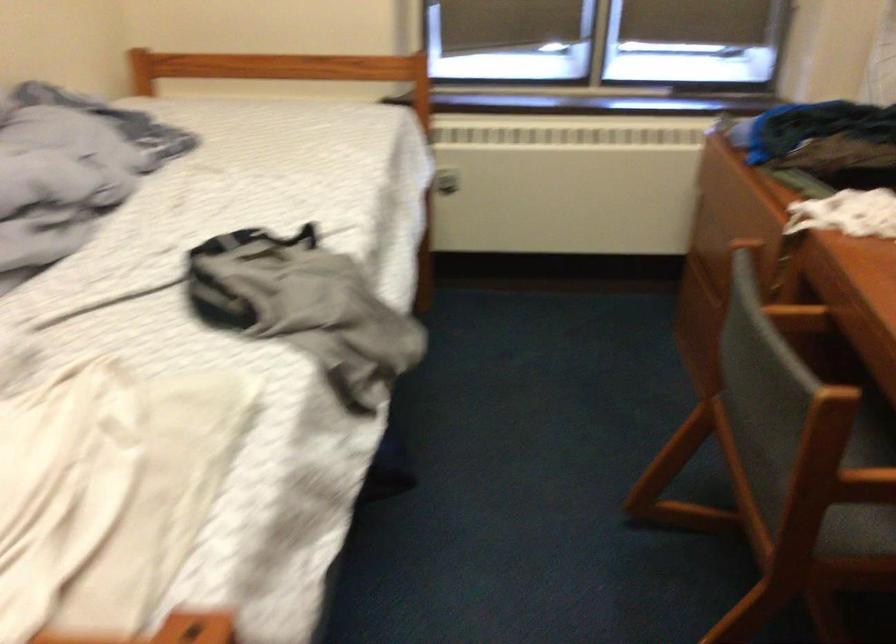
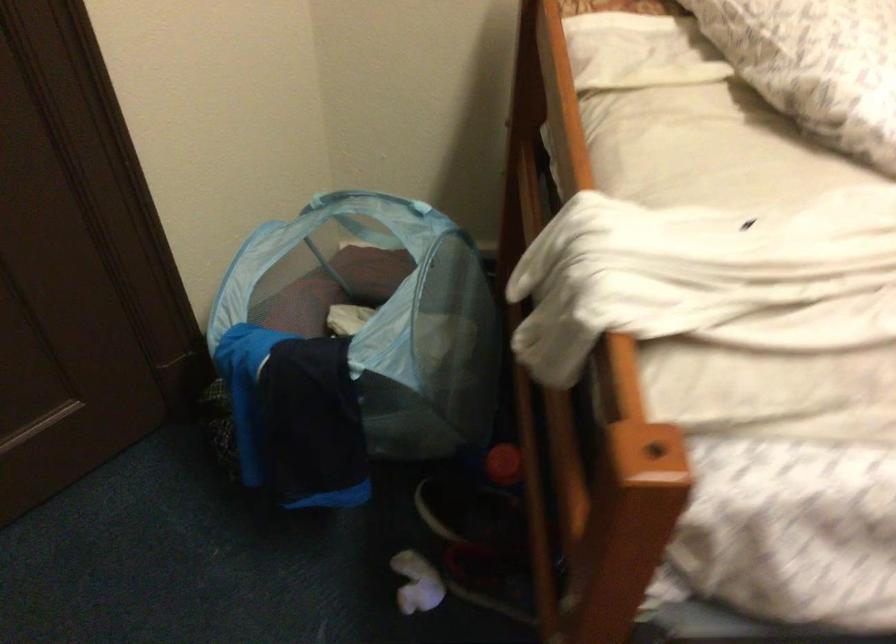
Based on the continuous images, in which direction is the camera rotating?

The rotation direction of the camera is left-down.